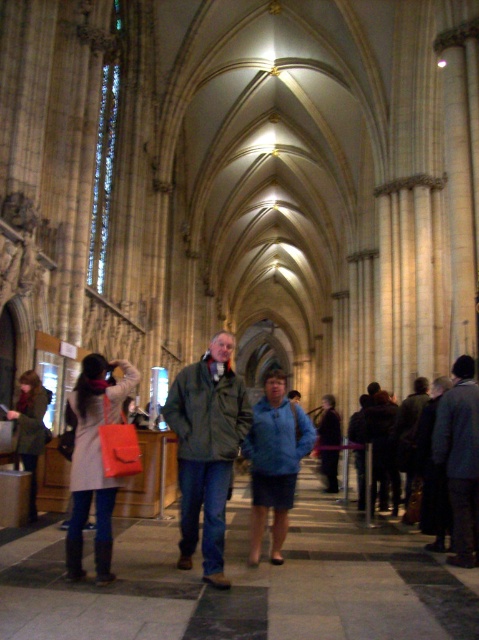
How distant is matte orange bag at center from dark gray wool coat at center?

matte orange bag at center and dark gray wool coat at center are 11.54 meters apart.

Can you confirm if matte orange bag at center is positioned below dark gray wool coat at center?

Indeed, matte orange bag at center is positioned under dark gray wool coat at center.

This screenshot has width=479, height=640. Describe the element at coordinates (93, 460) in the screenshot. I see `matte orange bag at center` at that location.

Image resolution: width=479 pixels, height=640 pixels. Identify the location of matte orange bag at center. (93, 460).

Does dark gray wool coat at center have a lesser width compared to matte brown coat at lower left?

No.

The height and width of the screenshot is (640, 479). Describe the element at coordinates (460, 458) in the screenshot. I see `dark gray wool coat at center` at that location.

At what (x,y) coordinates should I click in order to perform the action: click on dark gray wool coat at center. Please return your answer as a coordinate pair (x, y). The image size is (479, 640). Looking at the image, I should click on click(460, 458).

Between dark gray wool coat at center and dark blue fabric jacket at center, which one appears on the right side from the viewer's perspective?

dark gray wool coat at center

Does dark gray wool coat at center have a lesser width compared to dark blue fabric jacket at center?

Correct, dark gray wool coat at center's width is less than dark blue fabric jacket at center's.

Between point (447, 486) and point (318, 440), which one is positioned behind?

The point (318, 440) is more distant.

You are a GUI agent. You are given a task and a screenshot of the screen. Output one action in this format:
    pyautogui.click(x=<x>, y=<y>)
    Task: Click on the dark gray wool coat at center
    
    Given the screenshot: What is the action you would take?
    pyautogui.click(x=460, y=458)